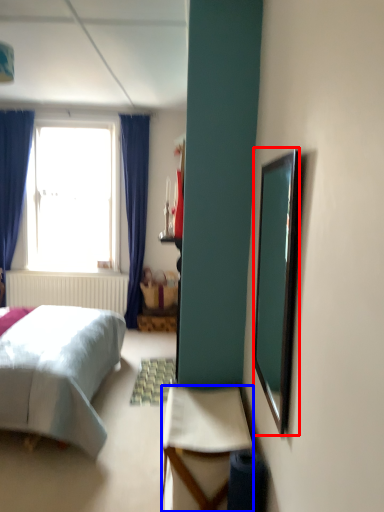
Question: Which of the following is the closest to the observer, mirror (highlighted by a red box) or desk (highlighted by a blue box)?

Choices:
 (A) mirror
 (B) desk

Answer: (A)